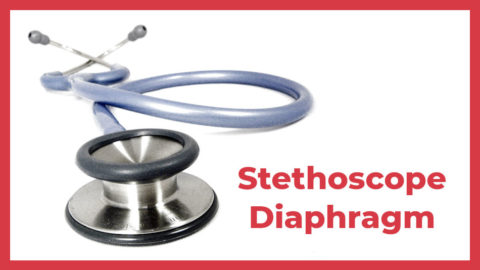
Where is `handle`? This screenshot has width=480, height=270. handle is located at coordinates (161, 166).